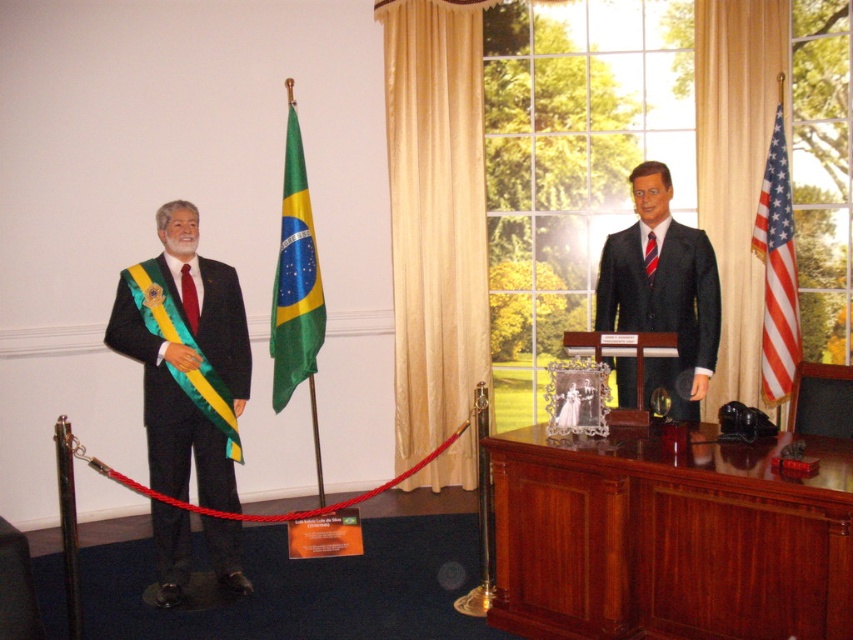
You are a visitor at the museum and want to take a photo of both the green satin flag at center and the american flag at right. Which flag should you focus on first if you want to capture both in the same frame without moving your camera?

The green satin flag at center is positioned on the left side of the american flag at right, so you should focus on the green satin flag at center first to ensure both flags are in the same frame without moving the camera.

You are an event planner setting up a historical exhibit. You have two flags to place on a desk in the museum scene. The green satin flag at center and the american flag at right. According to the description, which flag should you place in a more prominent position to emphasize its significance?

The green satin flag at center has a larger size compared to the american flag at right, so it should be placed in a more prominent position to emphasize its significance.

You are a tour guide at the museum and need to describe the arrangement of the matte black suit at left and the green satin flag at center to a visitor. Based on the scene, can you explain their positions relative to each other?

The matte black suit at left is positioned in front of the green satin flag at center, meaning the flag is located behind the suit in the exhibit space.